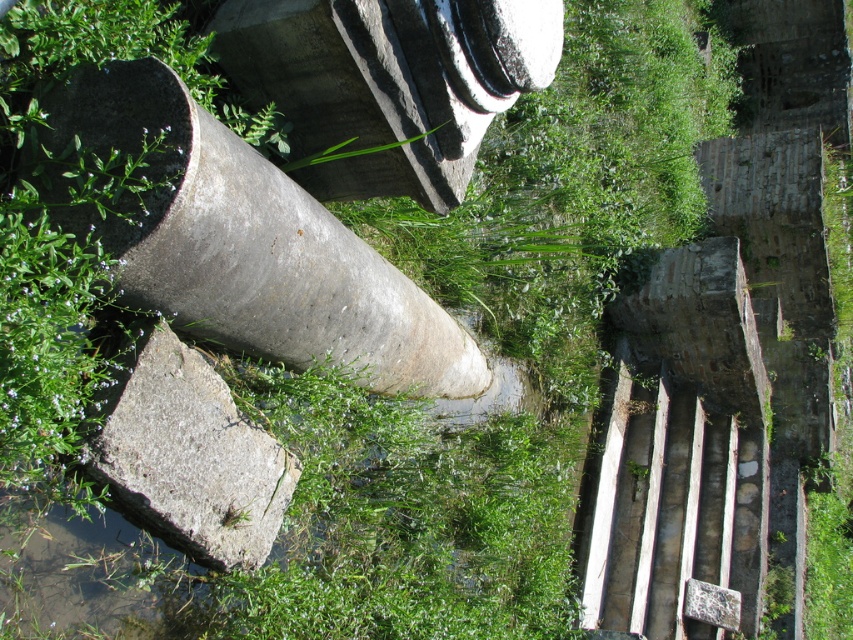
Question: Which of the following is the closest to the observer?

Choices:
 (A) gray rough concrete at lower left
 (B) rusty metallic water pipe at center-left

Answer: (B)

Question: Is rusty metallic water pipe at center-left wider than gray rough concrete at lower left?

Choices:
 (A) yes
 (B) no

Answer: (A)

Question: Which of the following is the farthest from the observer?

Choices:
 (A) gray rough concrete at lower left
 (B) rusty metallic water pipe at center-left

Answer: (A)

Question: Does rusty metallic water pipe at center-left appear on the right side of gray rough concrete at lower left?

Choices:
 (A) no
 (B) yes

Answer: (B)

Question: Is rusty metallic water pipe at center-left above gray rough concrete at lower left?

Choices:
 (A) no
 (B) yes

Answer: (B)

Question: Which object is farther from the camera taking this photo?

Choices:
 (A) rusty metallic water pipe at center-left
 (B) gray rough concrete at lower left

Answer: (B)